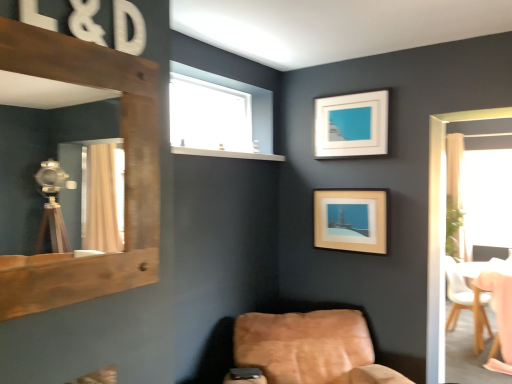
Describe the element at coordinates (465, 302) in the screenshot. I see `white leather chair at right, the first chair viewed from the back` at that location.

What is the approximate height of beige fabric curtain at right?

beige fabric curtain at right is 2.05 meters in height.

I want to click on wooden picture frame at center, the first picture frame ordered from the bottom, so click(x=351, y=220).

Identify the location of white matte picture frame at upper center, which ranks as the second picture frame in bottom-to-top order. (351, 125).

How much space does white matte picture frame at upper center, which ranks as the second picture frame in bottom-to-top order, occupy horizontally?

The width of white matte picture frame at upper center, which ranks as the second picture frame in bottom-to-top order, is 1.71 inches.

Find the location of a particular element. The height and width of the screenshot is (384, 512). transparent glass window at upper center is located at coordinates (218, 112).

In order to face rustic wood mirror at left, should I rotate leftwards or rightwards?

It's best to rotate left around 21.075 degrees.

This screenshot has width=512, height=384. I want to click on white leather chair at right, the second chair positioned from the right, so click(x=465, y=302).

Can you confirm if white matte picture frame at upper center, placed as the 1th picture frame when sorted from top to bottom, is positioned to the left of wooden picture frame at center, the 2th picture frame viewed from the top?

No.

From the image's perspective, is white matte picture frame at upper center, placed as the 1th picture frame when sorted from top to bottom, located above or below wooden picture frame at center, the 2th picture frame viewed from the top?

From the image's perspective, white matte picture frame at upper center, placed as the 1th picture frame when sorted from top to bottom, appears above wooden picture frame at center, the 2th picture frame viewed from the top.

Would you say white matte picture frame at upper center, which ranks as the second picture frame in bottom-to-top order, is outside wooden picture frame at center, the 2th picture frame viewed from the top?

white matte picture frame at upper center, which ranks as the second picture frame in bottom-to-top order, is positioned outside wooden picture frame at center, the 2th picture frame viewed from the top.

Is white matte picture frame at upper center, which ranks as the second picture frame in bottom-to-top order, bigger than wooden picture frame at center, the 2th picture frame viewed from the top?

Incorrect, white matte picture frame at upper center, which ranks as the second picture frame in bottom-to-top order, is not larger than wooden picture frame at center, the 2th picture frame viewed from the top.

Is white leather chair at right, the second chair positioned from the right, next to beige fabric curtain at right?

white leather chair at right, the second chair positioned from the right, and beige fabric curtain at right are not in contact.

From the image's perspective, is white leather chair at right, the first chair viewed from the back, on top of beige fabric curtain at right?

Incorrect, from the image's perspective, white leather chair at right, the first chair viewed from the back, is lower than beige fabric curtain at right.

Does white leather chair at right, the second chair from the left, have a lesser height compared to beige fabric curtain at right?

Yes.

From a real-world perspective, is wooden picture frame at center, the 2th picture frame viewed from the top, on top of transparent glass window at upper center?

Incorrect, from a real-world perspective, wooden picture frame at center, the 2th picture frame viewed from the top, is lower than transparent glass window at upper center.

How much distance is there between wooden picture frame at center, the 2th picture frame viewed from the top, and transparent glass window at upper center?

wooden picture frame at center, the 2th picture frame viewed from the top, is 32.24 inches away from transparent glass window at upper center.

Can you confirm if wooden picture frame at center, the first picture frame ordered from the bottom, is shorter than transparent glass window at upper center?

No.

Which point is more distant from viewer, [331,246] or [238,126]?

The point [238,126] is behind.

Based on the photo, from a real-world perspective, relative to leather at lower right, which is the 3th chair in right-to-left order, is white matte picture frame at upper center, which ranks as the second picture frame in bottom-to-top order, vertically above or below?

white matte picture frame at upper center, which ranks as the second picture frame in bottom-to-top order, is above leather at lower right, which is the 3th chair in right-to-left order.

Looking at this image, is white matte picture frame at upper center, placed as the 1th picture frame when sorted from top to bottom, in front of or behind leather at lower right, which is the 3th chair in right-to-left order, in the image?

In the image, white matte picture frame at upper center, placed as the 1th picture frame when sorted from top to bottom, appears behind leather at lower right, which is the 3th chair in right-to-left order.

Locate an element on the screen. chair in front of the white matte picture frame at upper center, placed as the 1th picture frame when sorted from top to bottom is located at coordinates (309, 349).

Considering the relative sizes of white matte picture frame at upper center, which ranks as the second picture frame in bottom-to-top order, and leather at lower right, which is the 3th chair in right-to-left order, in the image provided, is white matte picture frame at upper center, which ranks as the second picture frame in bottom-to-top order, wider than leather at lower right, which is the 3th chair in right-to-left order,?

In fact, white matte picture frame at upper center, which ranks as the second picture frame in bottom-to-top order, might be narrower than leather at lower right, which is the 3th chair in right-to-left order.

Is white leather chair at right, which is the 3th chair from front to back, at the back of wooden chair at lower right, the second chair positioned from the front?

No, wooden chair at lower right, the second chair positioned from the front, is not facing away from white leather chair at right, which is the 3th chair from front to back.

Which object is further away from the camera, wooden chair at lower right, the second chair positioned from the front, or white leather chair at right, the second chair positioned from the right?

Positioned behind is white leather chair at right, the second chair positioned from the right.

Does wooden chair at lower right, the second chair positioned from the front, appear on the right side of white leather chair at right, which is the 3th chair from front to back?

Yes, wooden chair at lower right, the second chair positioned from the front, is to the right of white leather chair at right, which is the 3th chair from front to back.

Consider the image. Is transparent glass window at upper center with wooden chair at lower right, which is the 1th chair in right-to-left order?

There is a gap between transparent glass window at upper center and wooden chair at lower right, which is the 1th chair in right-to-left order.

Considering the positions of objects transparent glass window at upper center and wooden chair at lower right, the 2th chair when ordered from back to front, in the image provided, who is in front, transparent glass window at upper center or wooden chair at lower right, the 2th chair when ordered from back to front,?

transparent glass window at upper center is in front.

Which is in front, point (193, 70) or point (485, 282)?

The point (193, 70) is more forward.

From the image's perspective, is white leather chair at right, the first chair viewed from the back, located above or below rustic wood mirror at left?

white leather chair at right, the first chair viewed from the back, is below rustic wood mirror at left.

Which is behind, point (488, 302) or point (10, 285)?

The point (488, 302) is more distant.

Is white leather chair at right, the second chair from the left, positioned far away from rustic wood mirror at left?

white leather chair at right, the second chair from the left, is far away from rustic wood mirror at left.

Is white leather chair at right, the second chair from the left, at the left side of rustic wood mirror at left?

Incorrect, white leather chair at right, the second chair from the left, is not on the left side of rustic wood mirror at left.

Where is `picture frame on the left of the white matte picture frame at upper center, which ranks as the second picture frame in bottom-to-top order`? The image size is (512, 384). picture frame on the left of the white matte picture frame at upper center, which ranks as the second picture frame in bottom-to-top order is located at coordinates (351, 220).

This screenshot has width=512, height=384. I want to click on curtain that appears on the right of white leather chair at right, the second chair positioned from the right, so click(x=454, y=196).

From the image, which object appears to be farther from wooden picture frame at center, the first picture frame ordered from the bottom, transparent glass window at upper center or wooden chair at lower right, the second chair positioned from the front?

wooden chair at lower right, the second chair positioned from the front, is further to wooden picture frame at center, the first picture frame ordered from the bottom.

Looking at the image, which one is located further to wooden picture frame at center, the 2th picture frame viewed from the top, white leather chair at right, the second chair from the left, or rustic wood mirror at left?

Based on the image, white leather chair at right, the second chair from the left, appears to be further to wooden picture frame at center, the 2th picture frame viewed from the top.

From the image, which object appears to be farther from wooden picture frame at center, the 2th picture frame viewed from the top, white leather chair at right, the second chair from the left, or white matte picture frame at upper center, placed as the 1th picture frame when sorted from top to bottom?

The object further to wooden picture frame at center, the 2th picture frame viewed from the top, is white leather chair at right, the second chair from the left.

Estimate the real-world distances between objects in this image. Which object is closer to transparent glass window at upper center, beige fabric curtain at right or white leather chair at right, the second chair from the left?

white leather chair at right, the second chair from the left, is positioned closer to the anchor transparent glass window at upper center.

When comparing their distances from wooden picture frame at center, the 2th picture frame viewed from the top, does wooden chair at lower right, which is the 1th chair in right-to-left order, or white leather chair at right, the first chair viewed from the back, seem closer?

The object closer to wooden picture frame at center, the 2th picture frame viewed from the top, is wooden chair at lower right, which is the 1th chair in right-to-left order.

From the image, which object appears to be farther from leather at lower right, which is the 3th chair in right-to-left order, wooden picture frame at center, the 2th picture frame viewed from the top, or beige fabric curtain at right?

Among the two, beige fabric curtain at right is located further to leather at lower right, which is the 3th chair in right-to-left order.

Considering their positions, is white leather chair at right, which is the 3th chair from front to back, positioned further to beige fabric curtain at right than transparent glass window at upper center?

Based on the image, transparent glass window at upper center appears to be further to beige fabric curtain at right.

Based on their spatial positions, is white matte picture frame at upper center, which ranks as the second picture frame in bottom-to-top order, or beige fabric curtain at right closer to white leather chair at right, the first chair viewed from the back?

beige fabric curtain at right lies closer to white leather chair at right, the first chair viewed from the back, than the other object.

Identify the location of picture frame between white matte picture frame at upper center, which ranks as the second picture frame in bottom-to-top order, and leather at lower right, which is the 3th chair in right-to-left order, vertically. (351, 220).

Image resolution: width=512 pixels, height=384 pixels. I want to click on chair between rustic wood mirror at left and wooden picture frame at center, the 2th picture frame viewed from the top, along the z-axis, so click(x=309, y=349).

Locate an element on the screen. window between leather at lower right, which is the 3th chair in right-to-left order, and beige fabric curtain at right, along the z-axis is located at coordinates (218, 112).

Locate an element on the screen. window between rustic wood mirror at left and white matte picture frame at upper center, placed as the 1th picture frame when sorted from top to bottom, in the front-back direction is located at coordinates (218, 112).